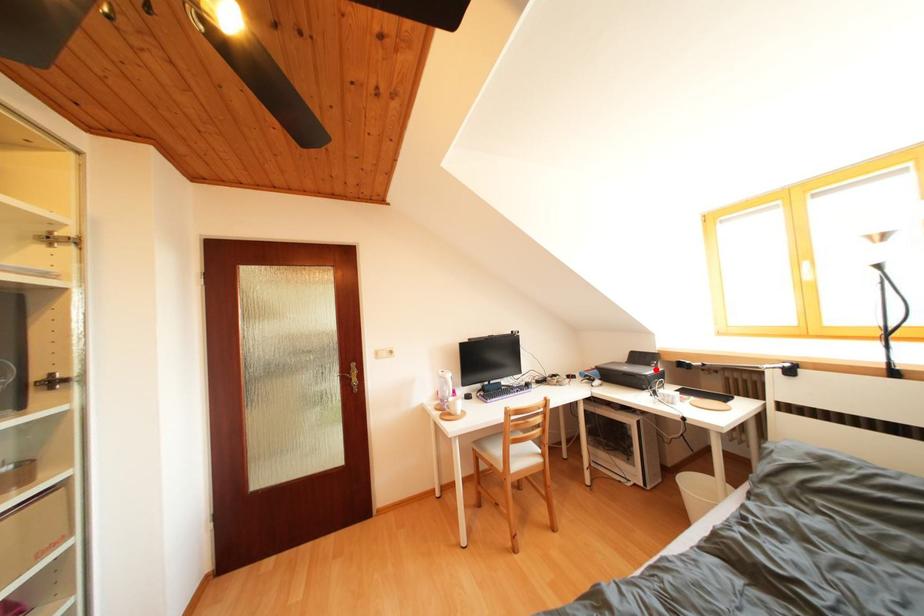
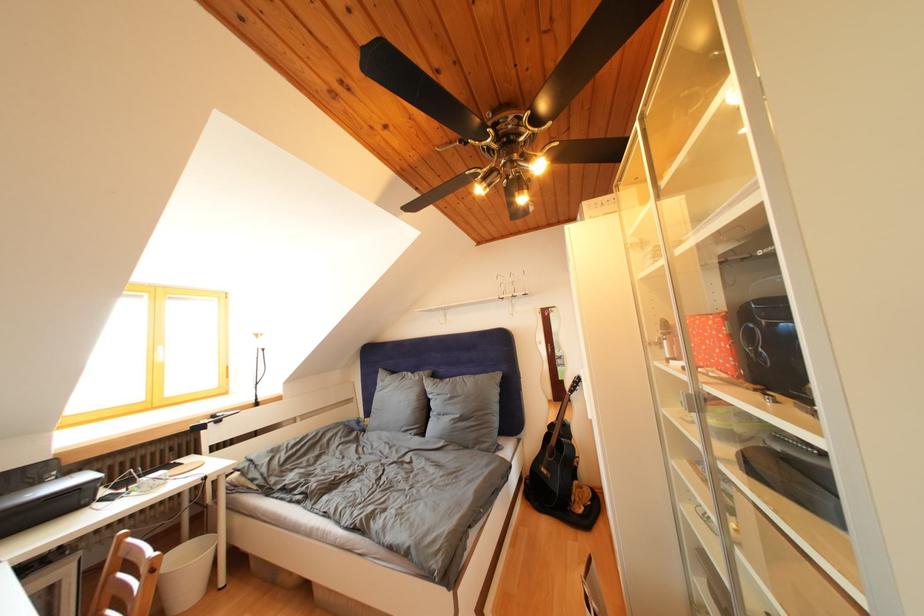
Question: A red point is marked in image1. In image2, is the corresponding 3D point closer to the camera or farther? Reply with the corresponding letter.

Choices:
 (A) The corresponding 3D point is closer.
 (B) The corresponding 3D point is farther.

Answer: (A)